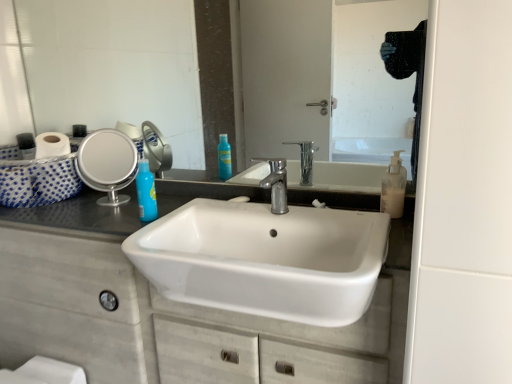
You are a GUI agent. You are given a task and a screenshot of the screen. Output one action in this format:
    pyautogui.click(x=<x>, y=<y>)
    Task: Click on the free point in front of translucent plastic soap dispenser at right
    The width and height of the screenshot is (512, 384).
    Given the screenshot: What is the action you would take?
    pyautogui.click(x=389, y=222)